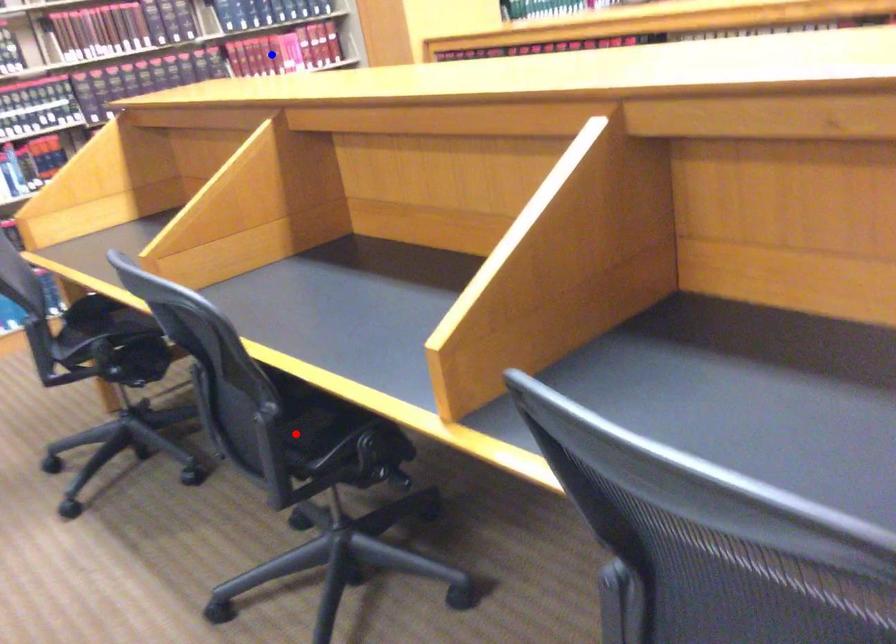
Question: Which of the two points in the image is closer to the camera?

Choices:
 (A) Blue point is closer.
 (B) Red point is closer.

Answer: (B)